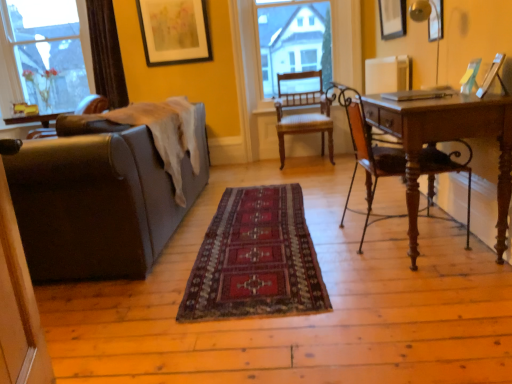
Question: Is white matte radiator at upper right at the right side of brown leather couch at left?

Choices:
 (A) yes
 (B) no

Answer: (A)

Question: Considering the relative sizes of white matte radiator at upper right and brown leather couch at left in the image provided, is white matte radiator at upper right shorter than brown leather couch at left?

Choices:
 (A) yes
 (B) no

Answer: (A)

Question: Would you say white matte radiator at upper right is outside brown leather couch at left?

Choices:
 (A) yes
 (B) no

Answer: (A)

Question: Is white matte radiator at upper right taller than brown leather couch at left?

Choices:
 (A) no
 (B) yes

Answer: (A)

Question: Is white matte radiator at upper right positioned far away from brown leather couch at left?

Choices:
 (A) no
 (B) yes

Answer: (B)

Question: From the image's perspective, is wooden picture frame at upper right, the third picture frame positioned from the left, located above or below brown leather couch at left?

Choices:
 (A) below
 (B) above

Answer: (B)

Question: Considering the positions of wooden picture frame at upper right, the 2th picture frame when ordered from back to front, and brown leather couch at left in the image, is wooden picture frame at upper right, the 2th picture frame when ordered from back to front, wider or thinner than brown leather couch at left?

Choices:
 (A) wide
 (B) thin

Answer: (B)

Question: In terms of size, does wooden picture frame at upper right, arranged as the 1th picture frame when viewed from the right, appear bigger or smaller than brown leather couch at left?

Choices:
 (A) small
 (B) big

Answer: (A)

Question: Considering the positions of wooden picture frame at upper right, the third picture frame positioned from the left, and brown leather couch at left in the image, is wooden picture frame at upper right, the third picture frame positioned from the left, taller or shorter than brown leather couch at left?

Choices:
 (A) short
 (B) tall

Answer: (A)

Question: From a real-world perspective, is metallic gold picture frame at upper right, which is the 1th picture frame in front-to-back order, positioned above or below clear glass window at upper left?

Choices:
 (A) below
 (B) above

Answer: (A)

Question: In the image, is metallic gold picture frame at upper right, the 2th picture frame positioned from the left, positioned in front of or behind clear glass window at upper left?

Choices:
 (A) front
 (B) behind

Answer: (A)

Question: In terms of size, does metallic gold picture frame at upper right, which is the 1th picture frame in front-to-back order, appear bigger or smaller than clear glass window at upper left?

Choices:
 (A) big
 (B) small

Answer: (B)

Question: In the image, is metallic gold picture frame at upper right, which is the 1th picture frame in front-to-back order, on the left side or the right side of clear glass window at upper left?

Choices:
 (A) left
 (B) right

Answer: (B)

Question: Based on their positions, is silver metallic laptop at right located to the left or right of matte black picture frame at upper center, the third picture frame when ordered from front to back?

Choices:
 (A) left
 (B) right

Answer: (B)

Question: Relative to matte black picture frame at upper center, the third picture frame when ordered from front to back, is silver metallic laptop at right in front or behind?

Choices:
 (A) behind
 (B) front

Answer: (B)